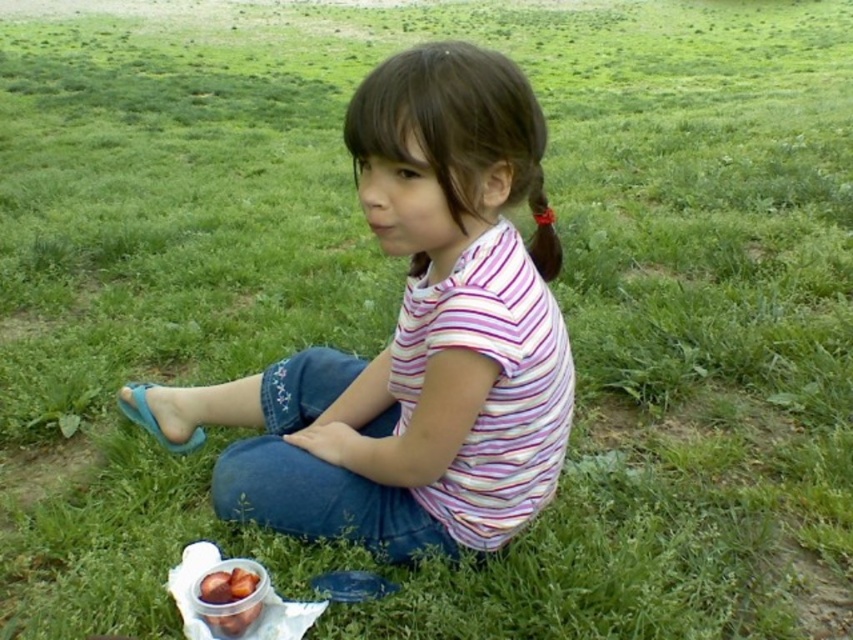
Is point (251, 376) more distant than point (198, 598)?

Yes.

Can you confirm if striped cotton shirt at center is shorter than shiny plastic container of nuts at lower left?

No.

Where is `striped cotton shirt at center`? This screenshot has width=853, height=640. striped cotton shirt at center is located at coordinates (415, 337).